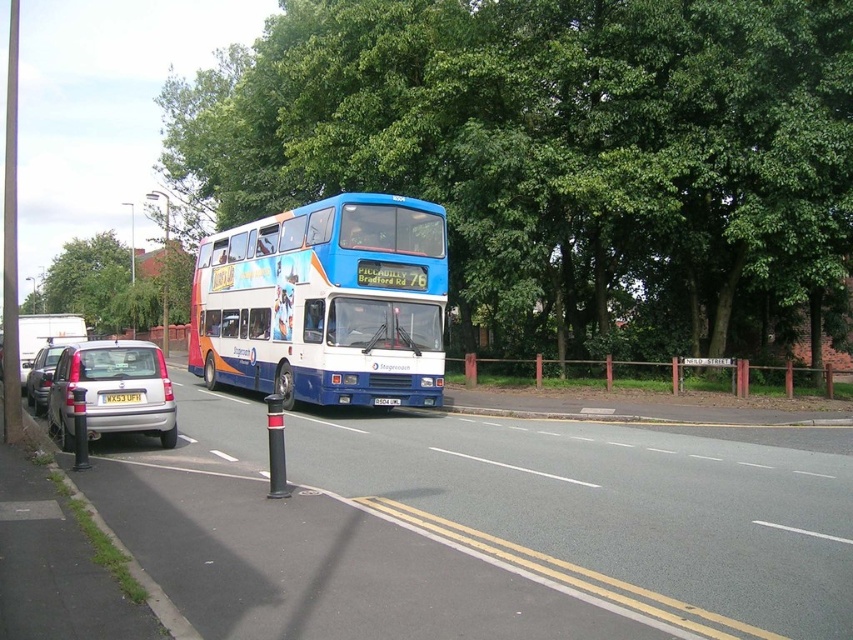
Question: In this image, where is green leafy tree at center located relative to blue painted decker bus at center?

Choices:
 (A) below
 (B) above

Answer: (B)

Question: Considering the relative positions of blue painted decker bus at center and silver metallic hatchback at lower left in the image provided, where is blue painted decker bus at center located with respect to silver metallic hatchback at lower left?

Choices:
 (A) right
 (B) left

Answer: (A)

Question: Considering the relative positions of blue painted decker bus at center and white plastic license plate at center in the image provided, where is blue painted decker bus at center located with respect to white plastic license plate at center?

Choices:
 (A) left
 (B) right

Answer: (A)

Question: Which point appears closest to the camera in this image?

Choices:
 (A) (131, 394)
 (B) (746, 388)
 (C) (374, 83)
 (D) (381, 397)

Answer: (A)

Question: Which point appears closest to the camera in this image?

Choices:
 (A) (300, 321)
 (B) (107, 396)

Answer: (B)

Question: Which point is farther to the camera?

Choices:
 (A) blue painted decker bus at center
 (B) white plastic license plate at center

Answer: (B)